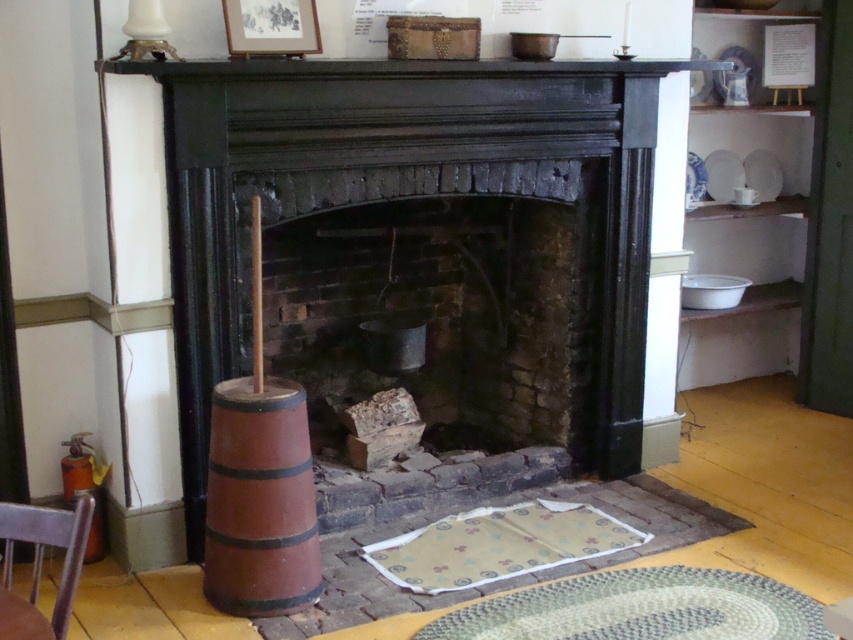
Question: Is black painted wood fireplace at center to the left of brown wooden chair at lower left from the viewer's perspective?

Choices:
 (A) yes
 (B) no

Answer: (B)

Question: Is black painted wood fireplace at center wider than brown wooden chair at lower left?

Choices:
 (A) no
 (B) yes

Answer: (B)

Question: Is black painted wood fireplace at center smaller than brown wooden chair at lower left?

Choices:
 (A) yes
 (B) no

Answer: (B)

Question: Which is nearer to the black painted wood fireplace at center?

Choices:
 (A) matte wooden picture frame at upper center
 (B) brown wooden barrel at left
 (C) smooth dark wood mantle at upper center
 (D) brown wooden chair at lower left

Answer: (C)

Question: Which is farther from the matte wooden picture frame at upper center?

Choices:
 (A) smooth dark wood mantle at upper center
 (B) black painted wood fireplace at center
 (C) brown wooden chair at lower left
 (D) brown wooden barrel at left

Answer: (C)

Question: Which of the following is the closest to the observer?

Choices:
 (A) brown wooden barrel at left
 (B) smooth dark wood mantle at upper center

Answer: (A)